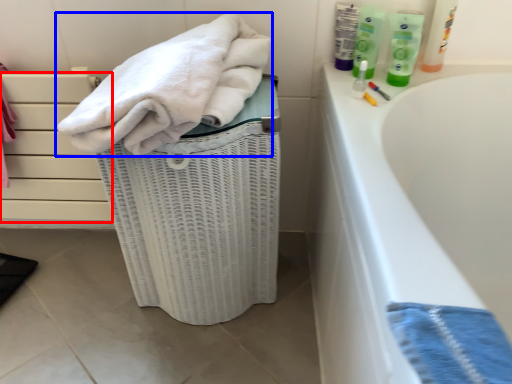
Question: Which object appears farthest to the camera in this image, drawer (highlighted by a red box) or towel (highlighted by a blue box)?

Choices:
 (A) drawer
 (B) towel

Answer: (A)